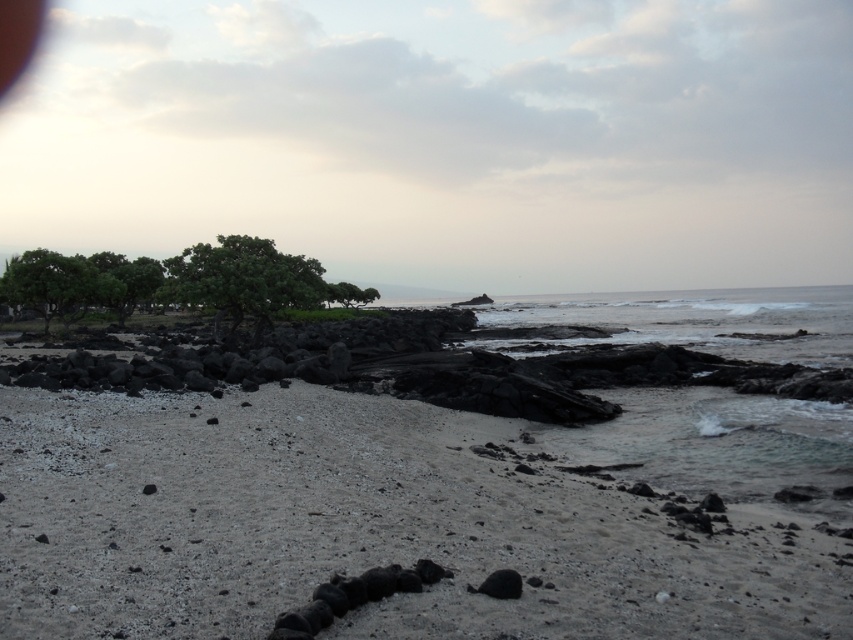
Question: Which point appears farthest from the camera in this image?

Choices:
 (A) (239, 250)
 (B) (322, 390)
 (C) (56, 310)
 (D) (97, 275)

Answer: (C)

Question: Does green leafy trees at left appear under green leafy tree at center?

Choices:
 (A) yes
 (B) no

Answer: (B)

Question: Which is nearer to the green leafy trees at left?

Choices:
 (A) green leafy tree at center
 (B) green leafy tree at upper left
 (C) smooth sand beach at center

Answer: (A)

Question: From the image, what is the correct spatial relationship of smooth sand beach at center in relation to green leafy trees at left?

Choices:
 (A) right
 (B) left

Answer: (A)

Question: Is smooth sand beach at center positioned behind green leafy tree at center?

Choices:
 (A) yes
 (B) no

Answer: (B)

Question: Which point is farther to the camera?

Choices:
 (A) green leafy trees at left
 (B) green leafy tree at upper left

Answer: (B)